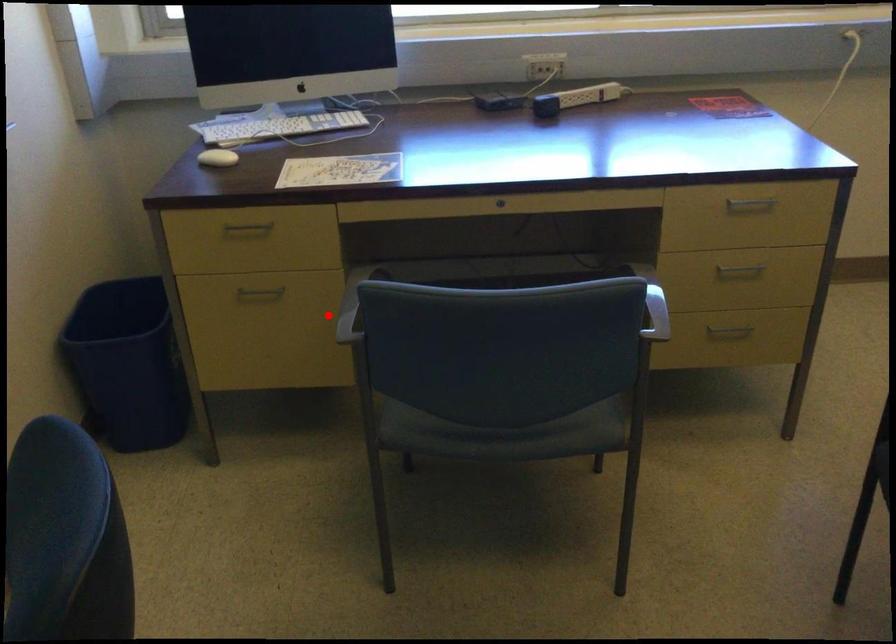
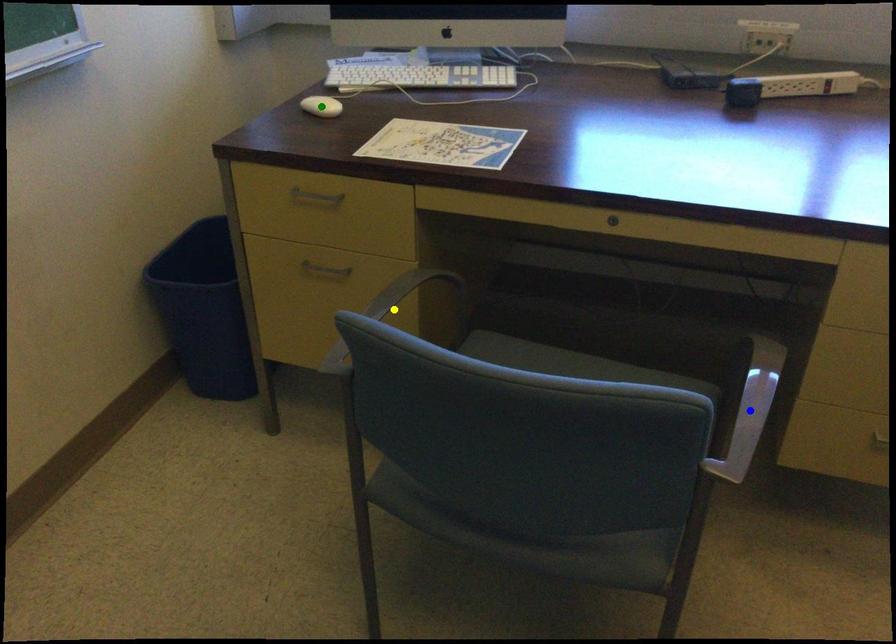
Question: I am providing you with two images of the same scene from different viewpoints. A red point is marked on the first image. You are given multiple points on the second image. Which mark in image 2 goes with the point in image 1?

Choices:
 (A) blue point
 (B) yellow point
 (C) green point

Answer: (B)